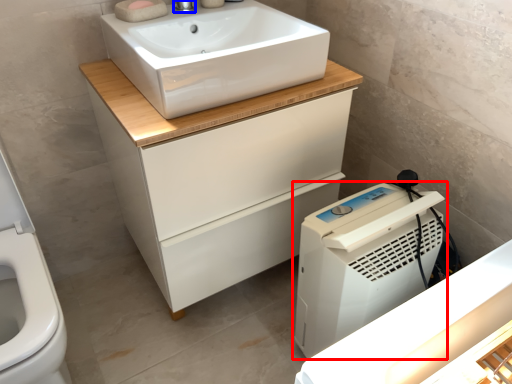
Question: Which object is further to the camera taking this photo, home appliance (highlighted by a red box) or tap (highlighted by a blue box)?

Choices:
 (A) home appliance
 (B) tap

Answer: (B)